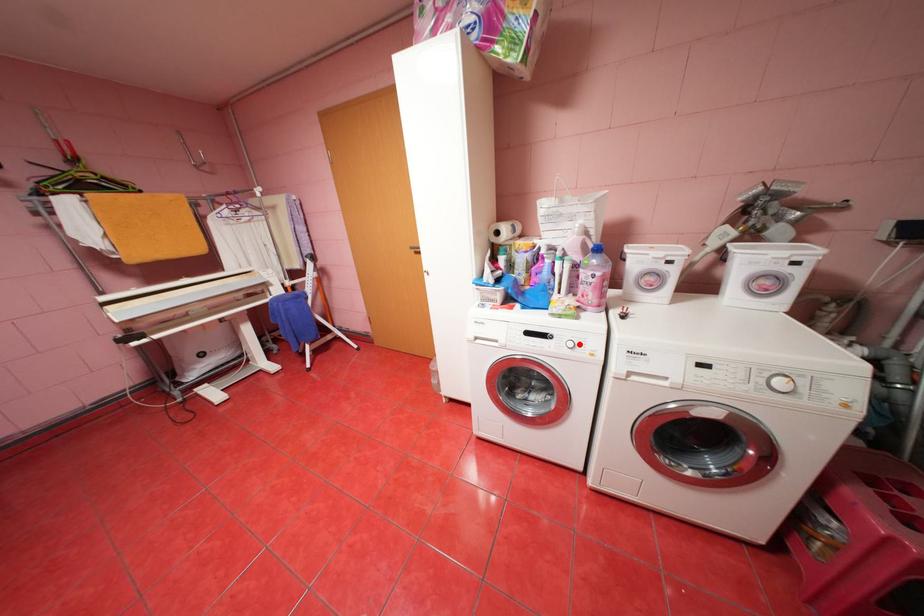
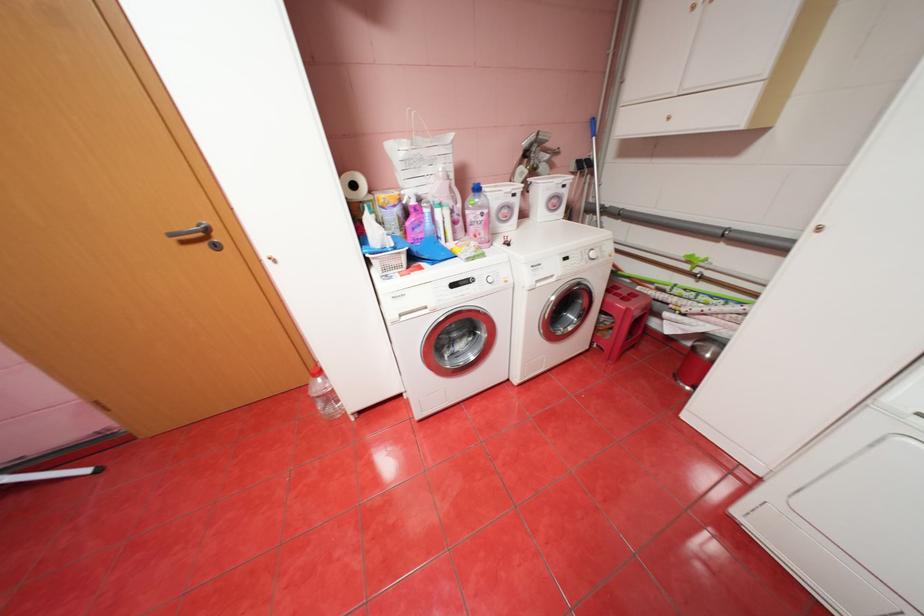
In the second image, find the point that corresponds to the highlighted location in the first image.

(499, 280)